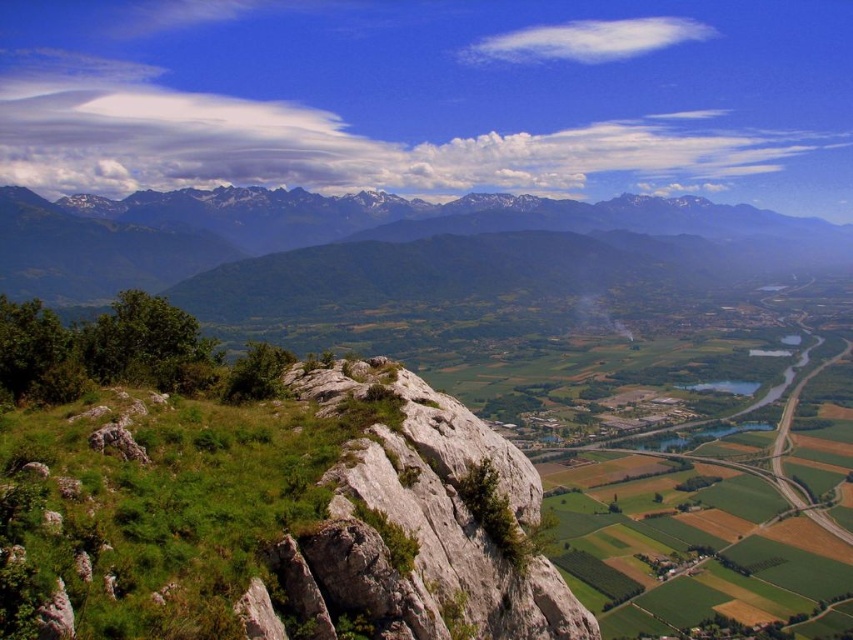
Question: Does green grassy rock at center come behind gray rocky mountains at upper left?

Choices:
 (A) no
 (B) yes

Answer: (A)

Question: Which point is farther to the camera?

Choices:
 (A) gray rocky mountains at upper left
 (B) green grassy rock at center

Answer: (A)

Question: Which object appears farthest from the camera in this image?

Choices:
 (A) gray rocky mountains at upper left
 (B) green grassy rock at center

Answer: (A)

Question: Which point is closer to the camera taking this photo?

Choices:
 (A) (88, 538)
 (B) (15, 291)

Answer: (A)

Question: Can you confirm if green grassy rock at center is thinner than gray rocky mountains at upper left?

Choices:
 (A) yes
 (B) no

Answer: (A)

Question: Is green grassy rock at center positioned before gray rocky mountains at upper left?

Choices:
 (A) no
 (B) yes

Answer: (B)